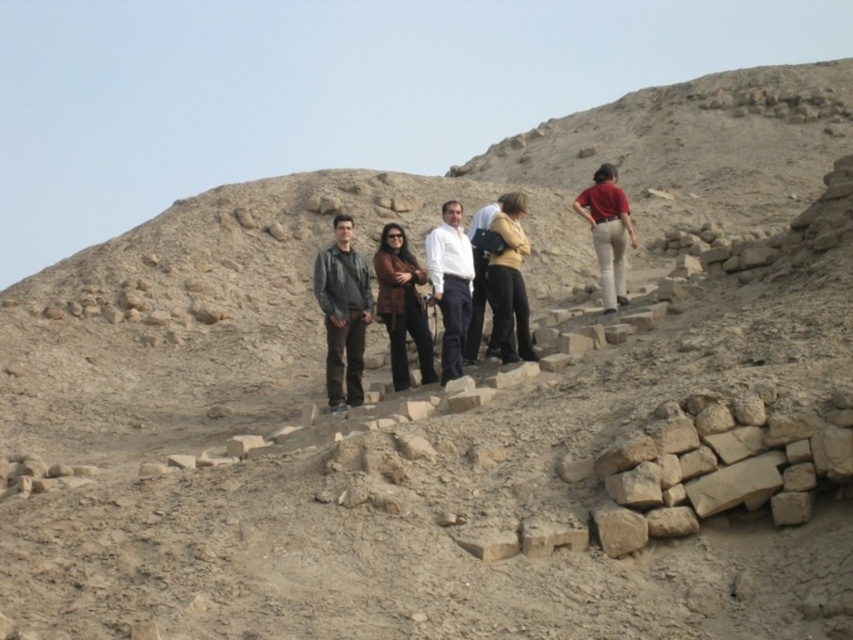
You are a photographer trying to adjust the focus on your camera. You want to ensure that both the dark gray leather jacket at center and the matte red shirt at upper right are in focus. Based on their positions, which one should you focus on first to achieve this?

You should focus on the dark gray leather jacket at center first since it is in front of the matte red shirt at upper right. By focusing on the closer subject, the depth of field will naturally include the background subject as well.

You are a photographer trying to capture a group photo at an archaeological site. You notice the brown leather jacket at center and the matte red shirt at upper right. Based on their positions, which person should you ask to move higher up to ensure both are clearly visible in the frame?

The brown leather jacket at center should move higher up because it is currently located below the matte red shirt at upper right, so moving it upwards would align both in a better visible position.

You are standing at the origin point of the coordinate system. You want to move towards the brown leather jacket at center. In which direction should you move?

The brown leather jacket at center is located at coordinate point (402,305). Since you are at the origin, you should move in the positive x and positive y direction to reach it.